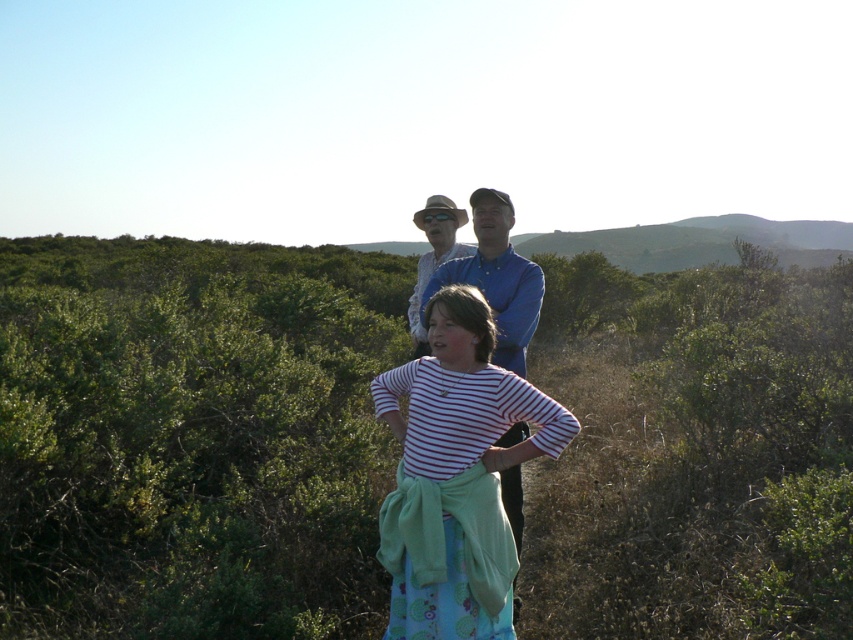
Who is shorter, blue denim shirt at center or matte white shirt at center?

Standing shorter between the two is matte white shirt at center.

Is the position of blue denim shirt at center more distant than that of matte white shirt at center?

That is False.

Identify the location of blue denim shirt at center. This screenshot has height=640, width=853. (496, 278).

You are a GUI agent. You are given a task and a screenshot of the screen. Output one action in this format:
    pyautogui.click(x=<x>, y=<y>)
    Task: Click on the green leafy shrubs at center
    The width and height of the screenshot is (853, 640).
    Given the screenshot: What is the action you would take?
    pyautogui.click(x=192, y=436)

Locate an element on the screen. green leafy shrubs at center is located at coordinates (192, 436).

Between point (457, 348) and point (514, 493), which one is positioned in front?

Point (457, 348) is in front.

Is striped cotton shirt at center wider than blue denim shirt at center?

Correct, the width of striped cotton shirt at center exceeds that of blue denim shirt at center.

Between point (463, 470) and point (471, 284), which one is positioned behind?

The point (471, 284) is more distant.

Where is `striped cotton shirt at center`? striped cotton shirt at center is located at coordinates (456, 476).